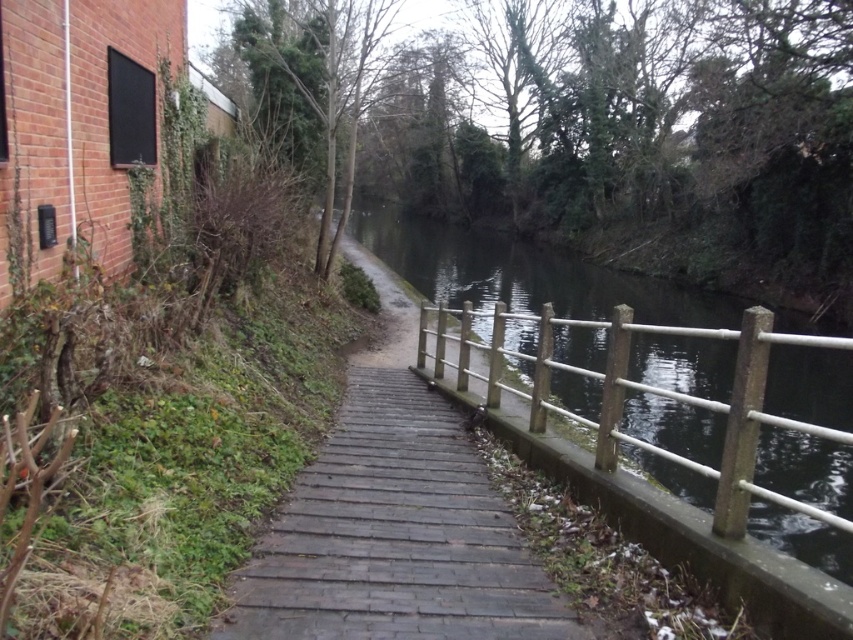
You are standing at the point marked as point (393, 522) in the image. What material is the surface you are currently standing on?

The surface at point (393, 522) is made of wooden planks at center.

You are a delivery person carrying a large package and need to walk along the pathway between the wooden planks at center and the wooden rail at center. Which side of the pathway should you choose to ensure there is enough space for your package?

The wooden planks at center is shorter than the wooden rail at center, so you should choose the side with the wooden rail at center to ensure there is enough space for your package.

You are standing on the narrow brick pathway and want to place a small potted plant between the wooden planks at center and the wooden rail at center. According to the scene, which object should the plant be placed closer to in order to be visible from your current position?

The wooden planks at center are closer to the viewer than the wooden rail at center, so placing the plant closer to the wooden planks at center would make it more visible from your current position.